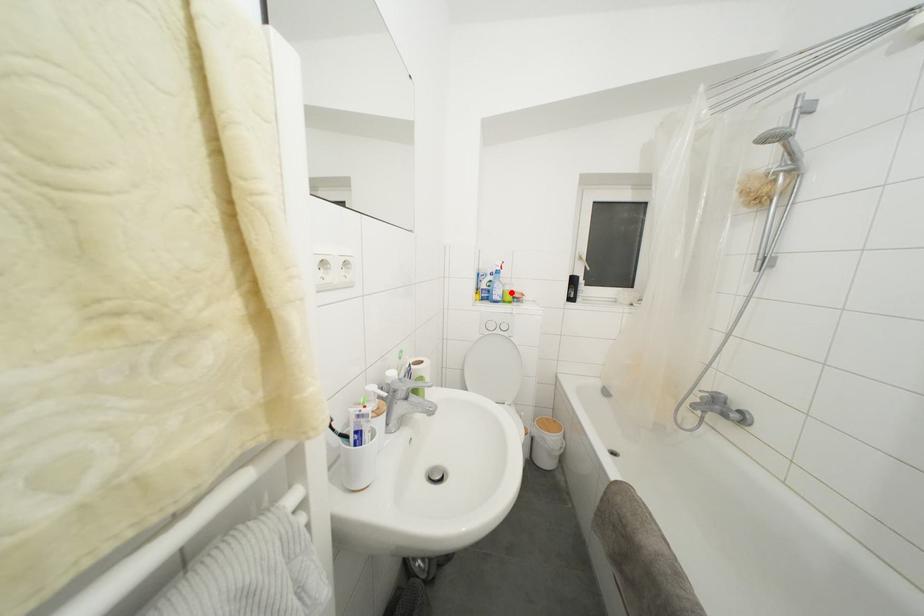
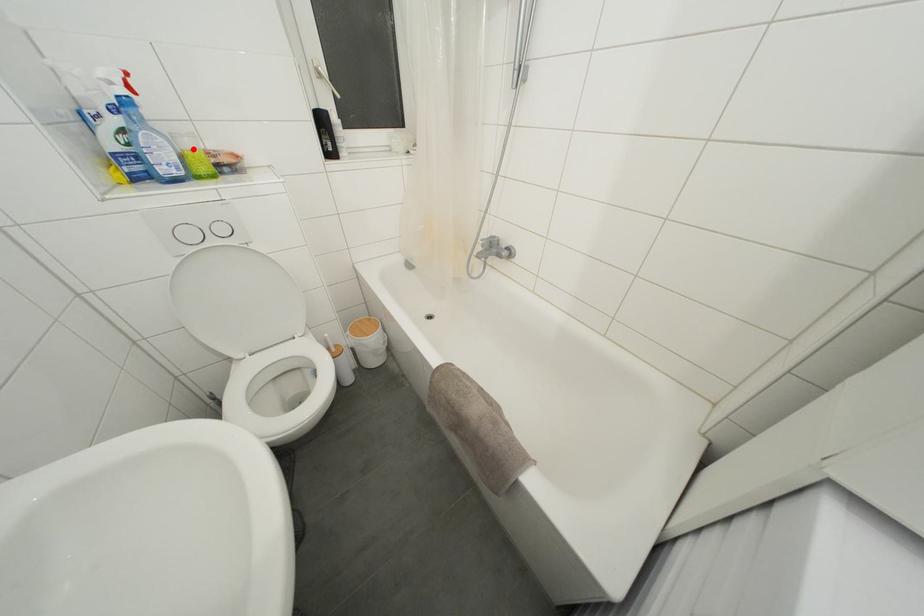
I am providing you with two images of the same scene from different viewpoints. A red point is marked on the first image and another point is marked on the second image. Do the highlighted points in image1 and image2 indicate the same real-world spot?

Yes